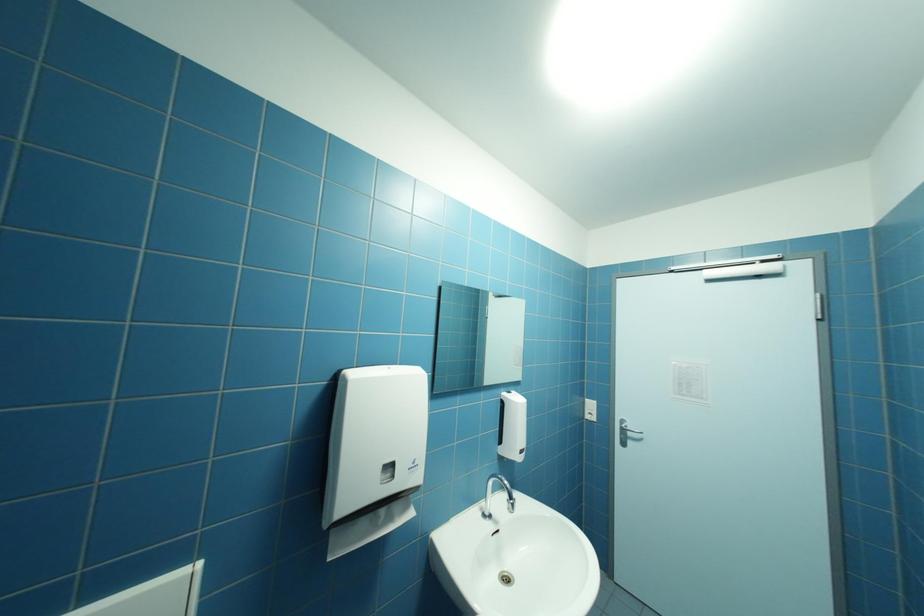
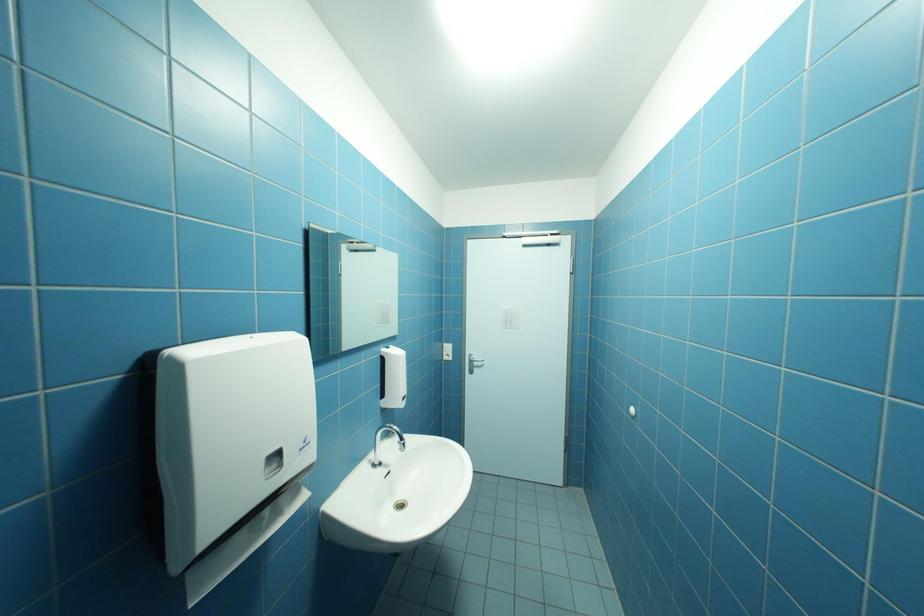
Question: The images are taken continuously from a first-person perspective. In which direction is your viewpoint rotating?

Choices:
 (A) Left
 (B) Right
 (C) Up
 (D) Down

Answer: (B)